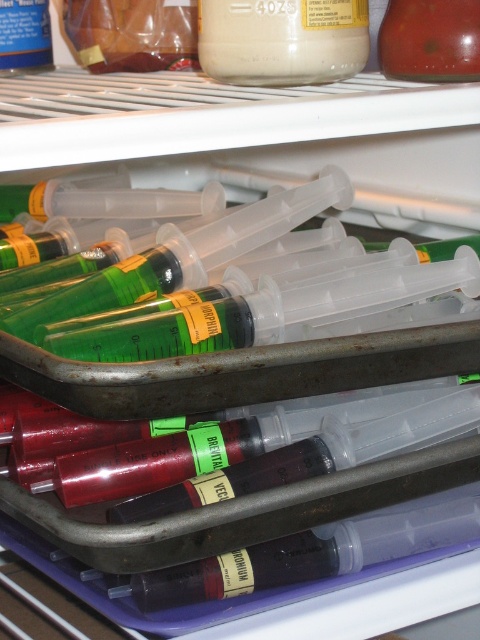
You are a medical professional trying to locate two specific points inside the refrigerator shelf. The first point is labeled as point 1 at coordinates point (103, 38) and the second is point 2 at coordinates point (39, 33). Which point is closer to you when you open the refrigerator?

Point 1 at coordinates point (103, 38) is closer to you because it is further to the viewer than point 2 at coordinates point (39, 33).

What is located at the coordinate point (132, 33) on the refrigerator shelf?

The coordinate point (132, 33) on the refrigerator shelf indicates the location of translucent plastic bottles at upper left.